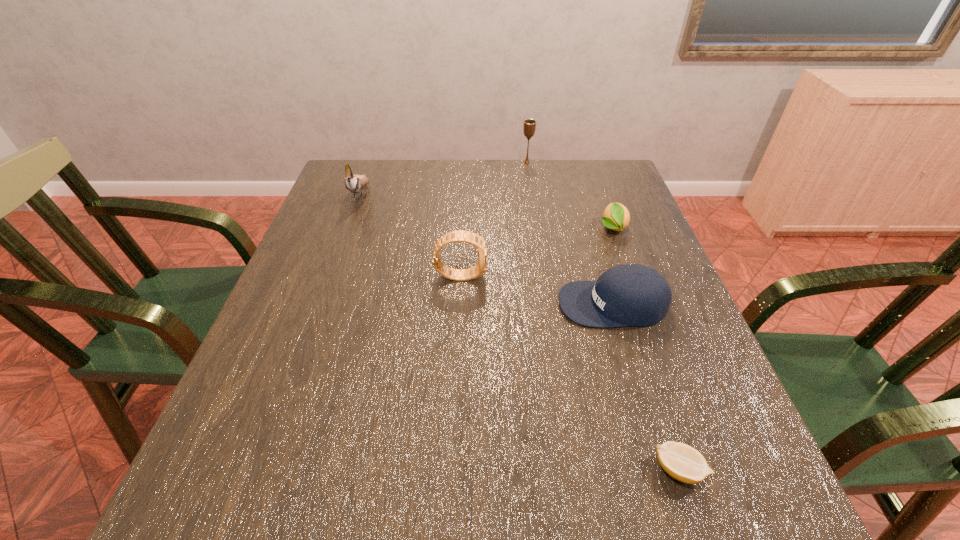
You are a GUI agent. You are given a task and a screenshot of the screen. Output one action in this format:
    pyautogui.click(x=<x>, y=<y>)
    Task: Click on the object that is at the near edge
    Image resolution: width=960 pixels, height=540 pixels.
    Given the screenshot: What is the action you would take?
    pyautogui.click(x=682, y=462)

I want to click on object present at the left edge, so click(x=354, y=183).

I want to click on baseball cap situated at the right edge, so click(x=636, y=295).

The height and width of the screenshot is (540, 960). Identify the location of object located in the far left corner section of the desktop. (354, 183).

Where is `object that is at the near right corner`? This screenshot has width=960, height=540. object that is at the near right corner is located at coordinates (682, 462).

Locate an element on the screen. Image resolution: width=960 pixels, height=540 pixels. vacant region at the far edge is located at coordinates (453, 200).

Image resolution: width=960 pixels, height=540 pixels. In the image, there is a desktop. Identify the location of vacant space at the near edge. (659, 518).

The width and height of the screenshot is (960, 540). In order to click on vacant region at the left edge of the desktop in this screenshot , I will do `click(374, 225)`.

The image size is (960, 540). Find the location of `vacant space at the right edge of the desktop`. vacant space at the right edge of the desktop is located at coordinates point(647,238).

Identify the location of vacant space at the far left corner. The image size is (960, 540). (380, 184).